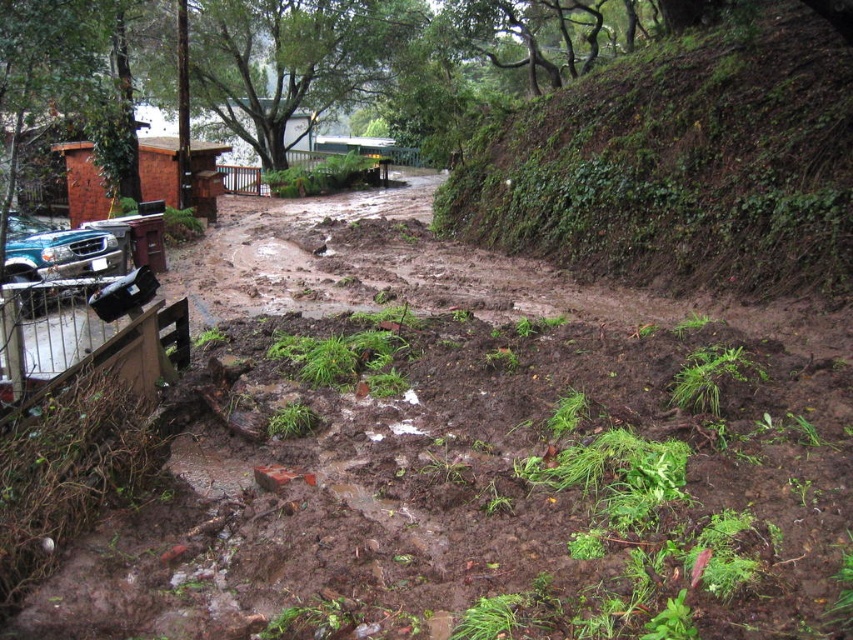
Question: Can you confirm if green mossy hillside at upper right is positioned above matte blue truck at left?

Choices:
 (A) no
 (B) yes

Answer: (B)

Question: Is green mossy hillside at upper right behind matte blue truck at left?

Choices:
 (A) yes
 (B) no

Answer: (B)

Question: Observing the image, what is the correct spatial positioning of green mossy hillside at upper right in reference to matte blue truck at left?

Choices:
 (A) above
 (B) below

Answer: (A)